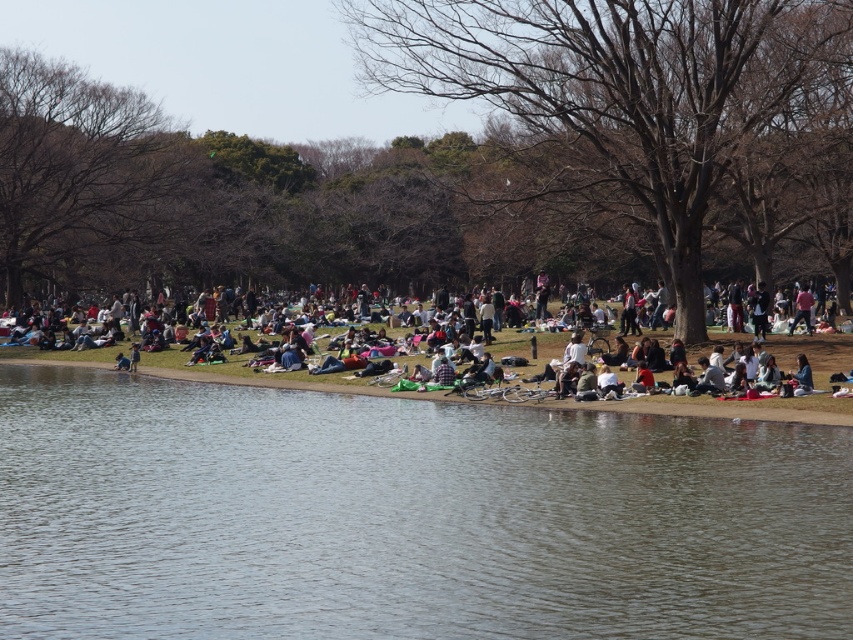
You are a person standing on the shoreline and see the clear water at lower center and the light brown fabric picnic blanket at center. Which object is closer to your current position?

The clear water at lower center is closer to your current position because it is located below the light brown fabric picnic blanket at center, meaning it is nearer to the shoreline where you are standing.